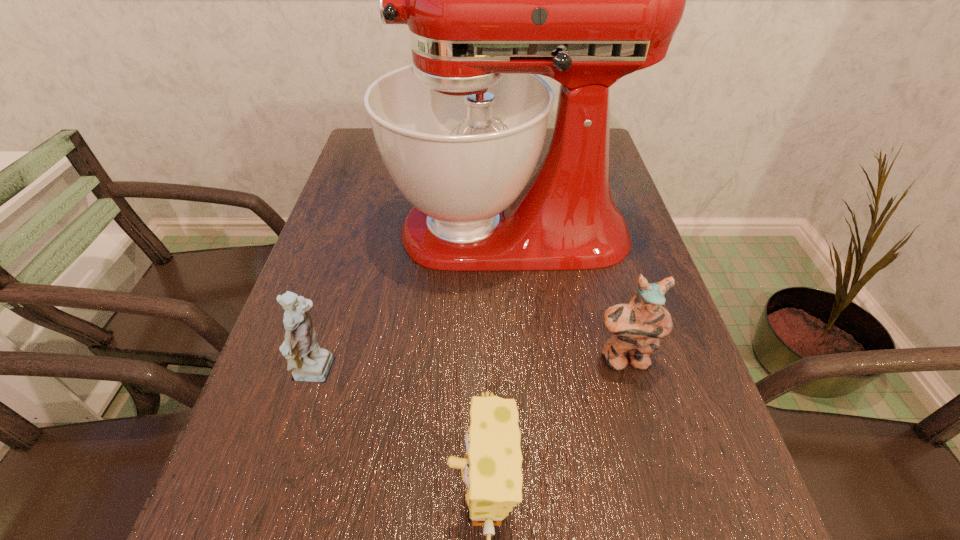
Where is `figurine at the left edge`? This screenshot has height=540, width=960. figurine at the left edge is located at coordinates (310, 363).

Locate an element on the screen. mixer present at the right edge is located at coordinates (492, 0).

At what (x,y) coordinates should I click in order to perform the action: click on figurine that is at the right edge. Please return your answer as a coordinate pair (x, y). The width and height of the screenshot is (960, 540). Looking at the image, I should click on (637, 327).

Where is `vacant area at the left edge`? This screenshot has width=960, height=540. vacant area at the left edge is located at coordinates 350,370.

In order to click on vacant space at the right edge of the desktop in this screenshot , I will do `click(622, 424)`.

The height and width of the screenshot is (540, 960). In order to click on free space at the far left corner in this screenshot , I will do `click(370, 145)`.

The width and height of the screenshot is (960, 540). Identify the location of vacant area between the left figurine and the farthest object. (414, 302).

Locate an element on the screen. The image size is (960, 540). vacant area that lies between the right figurine and the left figurine is located at coordinates (470, 367).

Where is `vacant space that is in between the leftmost object and the right figurine`? This screenshot has height=540, width=960. vacant space that is in between the leftmost object and the right figurine is located at coordinates (470, 367).

Where is `free spot between the right figurine and the farthest object`? The image size is (960, 540). free spot between the right figurine and the farthest object is located at coordinates (566, 295).